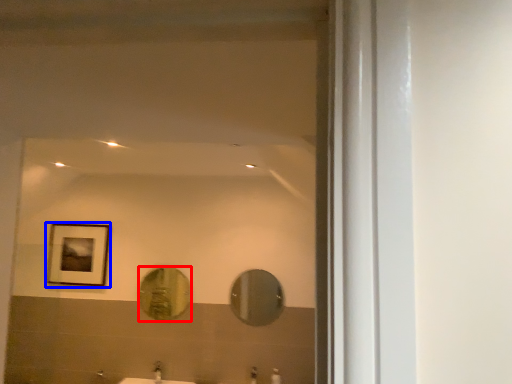
Question: Among these objects, which one is farthest to the camera, mirror (highlighted by a red box) or picture frame (highlighted by a blue box)?

Choices:
 (A) mirror
 (B) picture frame

Answer: (B)